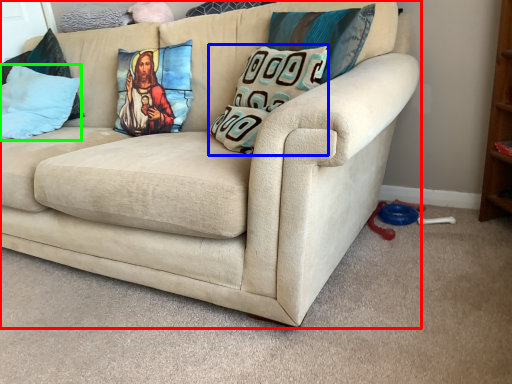
Question: Considering the real-world distances, which object is farthest from studio couch (highlighted by a red box)? pillow (highlighted by a blue box) or pillow (highlighted by a green box)?

Choices:
 (A) pillow
 (B) pillow

Answer: (B)